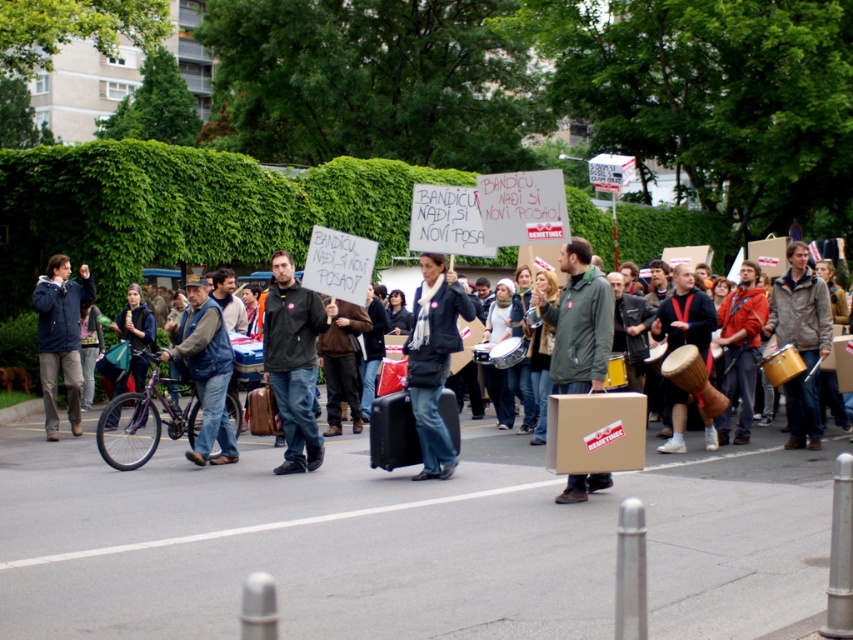
Based on the photo, does matte black suitcase at center have a lesser height compared to denim jacket at center?

Yes, matte black suitcase at center is shorter than denim jacket at center.

Locate an element on the screen. This screenshot has height=640, width=853. matte black suitcase at center is located at coordinates (724, 456).

Can you confirm if matte green jacket at center is positioned to the left of golden drum at center?

Yes, matte green jacket at center is to the left of golden drum at center.

Which is below, matte green jacket at center or golden drum at center?

Positioned lower is golden drum at center.

The width and height of the screenshot is (853, 640). Find the location of `matte green jacket at center`. matte green jacket at center is located at coordinates (579, 323).

Who is taller, matte green jacket at center or matte black suitcase at center?

Standing taller between the two is matte green jacket at center.

Which is in front, point (558, 362) or point (416, 460)?

Point (558, 362) is more forward.

Where is `matte green jacket at center`? matte green jacket at center is located at coordinates (579, 323).